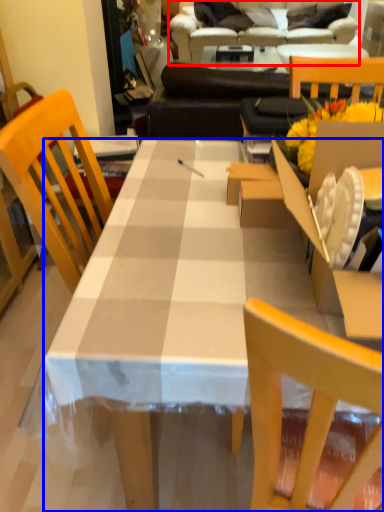
Question: Which object appears farthest to the camera in this image, studio couch (highlighted by a red box) or desk (highlighted by a blue box)?

Choices:
 (A) studio couch
 (B) desk

Answer: (A)